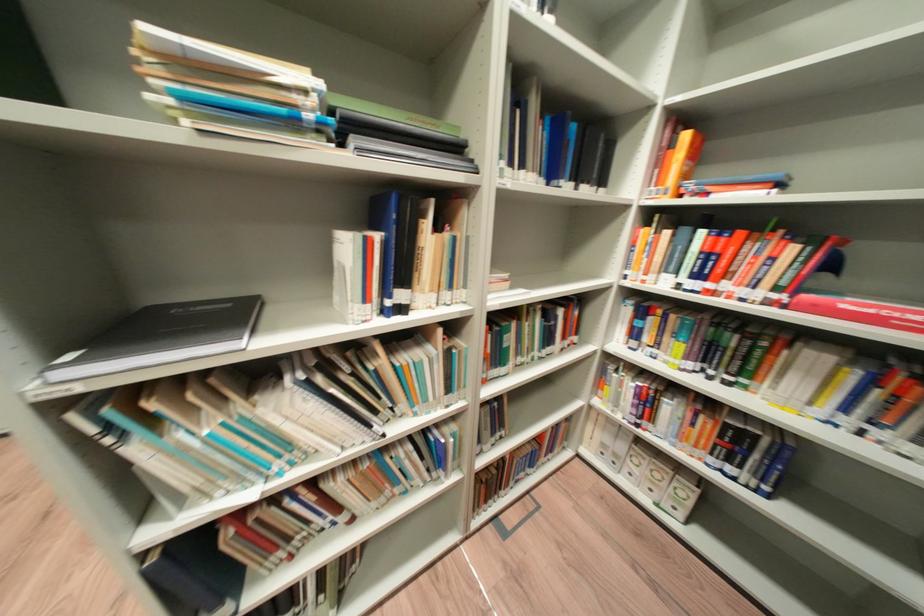
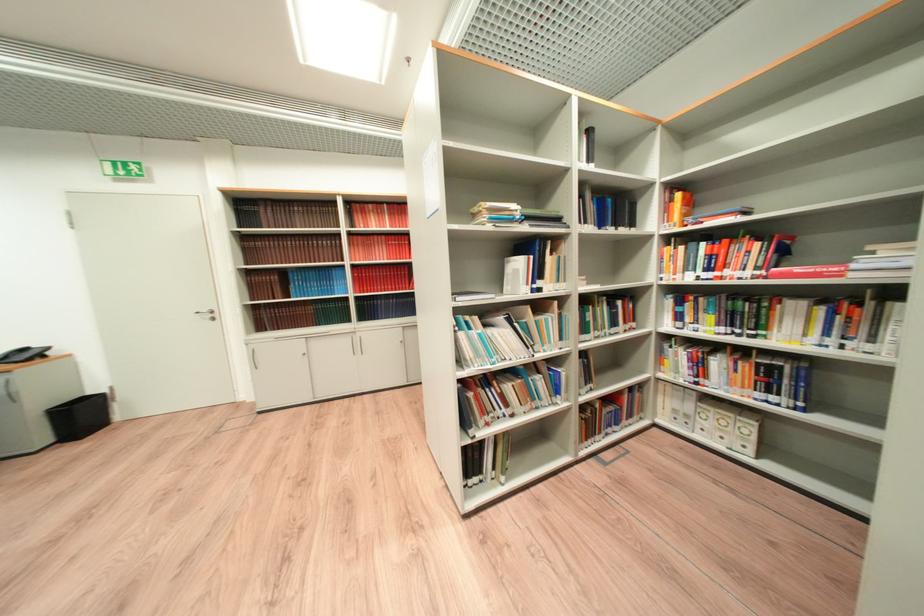
Which direction would the cameraman need to move to produce the second image?

The movement direction of the cameraman is left, backward.